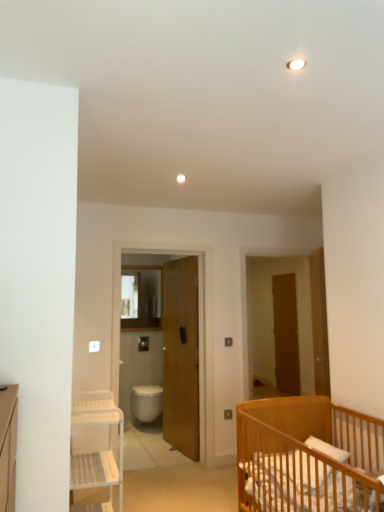
Question: Is white plastic shelf at left not near wooden screen door at center?

Choices:
 (A) yes
 (B) no

Answer: (A)

Question: Is white plastic shelf at left taller than wooden screen door at center?

Choices:
 (A) yes
 (B) no

Answer: (B)

Question: Is white plastic shelf at left outside wooden screen door at center?

Choices:
 (A) no
 (B) yes

Answer: (B)

Question: Can you confirm if white plastic shelf at left is thinner than wooden screen door at center?

Choices:
 (A) yes
 (B) no

Answer: (B)

Question: From the image's perspective, is white plastic shelf at left above wooden screen door at center?

Choices:
 (A) yes
 (B) no

Answer: (B)

Question: Does white plastic shelf at left have a lesser height compared to wooden screen door at center?

Choices:
 (A) yes
 (B) no

Answer: (A)

Question: Does wooden door at center, which appears as the 3th door when viewed from the right, have a greater width compared to white glossy toilet bowl at center?

Choices:
 (A) yes
 (B) no

Answer: (B)

Question: Does wooden door at center, which is the 2th door from back to front, have a larger size compared to white glossy toilet bowl at center?

Choices:
 (A) yes
 (B) no

Answer: (A)

Question: Are wooden door at center, which appears as the 3th door when viewed from the right, and white glossy toilet bowl at center making contact?

Choices:
 (A) yes
 (B) no

Answer: (B)

Question: From the image's perspective, is wooden door at center, marked as the 2th door in a front-to-back arrangement, under white glossy toilet bowl at center?

Choices:
 (A) yes
 (B) no

Answer: (B)

Question: Does wooden door at center, acting as the first door starting from the left, have a lesser width compared to white glossy toilet bowl at center?

Choices:
 (A) no
 (B) yes

Answer: (B)

Question: Is white glossy toilet bowl at center surrounded by wooden door at center, acting as the first door starting from the left?

Choices:
 (A) no
 (B) yes

Answer: (A)

Question: Is white glossy toilet bowl at center positioned in front of white plastic shelf at left?

Choices:
 (A) yes
 (B) no

Answer: (B)